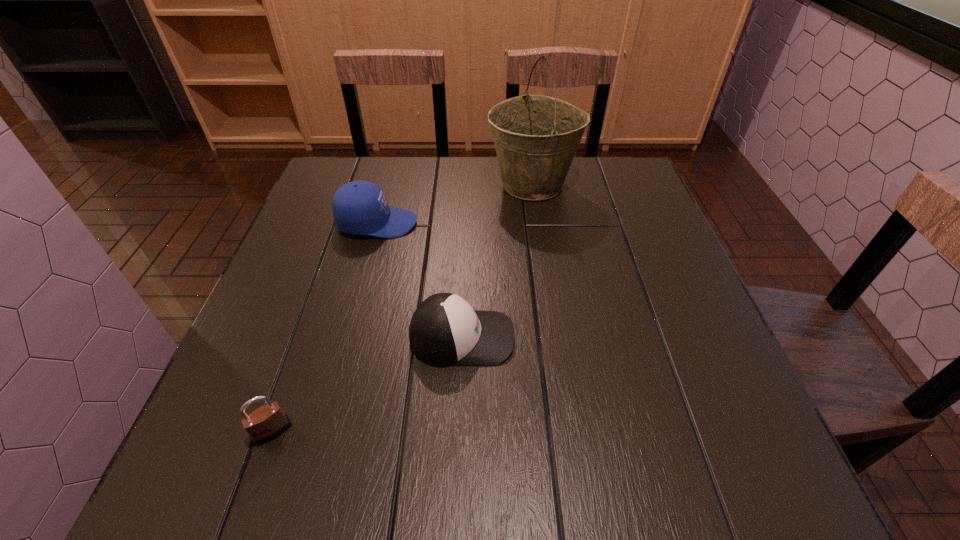
Identify the location of the tallest object. The image size is (960, 540). (536, 137).

The image size is (960, 540). What are the coordinates of `the farther cap` in the screenshot? It's located at (359, 207).

Where is `padlock`? Image resolution: width=960 pixels, height=540 pixels. padlock is located at coordinates (266, 423).

Where is `the nearer cap`? The image size is (960, 540). the nearer cap is located at coordinates (445, 330).

You are a GUI agent. You are given a task and a screenshot of the screen. Output one action in this format:
    pyautogui.click(x=<x>, y=<y>)
    Task: Click on the shorter cap
    The width and height of the screenshot is (960, 540).
    Given the screenshot: What is the action you would take?
    pyautogui.click(x=445, y=330)

Find the location of a particular element. The image size is (960, 540). free space located 0.210m on the front of the wine bucket is located at coordinates click(x=545, y=266).

The width and height of the screenshot is (960, 540). Identify the location of vacant region located on the front-facing side of the left cap. (493, 223).

What are the coordinates of `vacant space positioned on the right of the nearest object` in the screenshot? It's located at pyautogui.click(x=352, y=431).

Where is `vacant space situated on the front panel of the third farthest object`? The height and width of the screenshot is (540, 960). vacant space situated on the front panel of the third farthest object is located at coordinates (597, 338).

Where is `object that is at the far edge`? This screenshot has height=540, width=960. object that is at the far edge is located at coordinates [x=536, y=137].